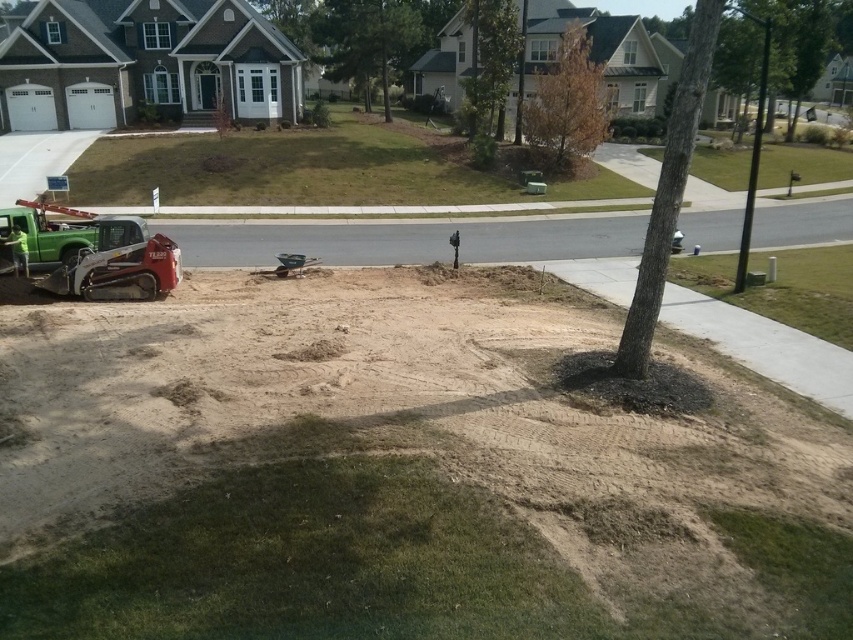
Is green leafy tree at upper center thinner than brown textured tree at center?

No, green leafy tree at upper center is not thinner than brown textured tree at center.

Is green leafy tree at upper center positioned in front of brown textured tree at center?

No.

Find the location of a particular element. The width and height of the screenshot is (853, 640). green leafy tree at upper center is located at coordinates (366, 38).

The width and height of the screenshot is (853, 640). In order to click on green leafy tree at upper center in this screenshot , I will do `click(366, 38)`.

Is brown textured tree at lower right above brown textured tree at upper center?

Incorrect, brown textured tree at lower right is not positioned above brown textured tree at upper center.

In the scene shown: Is brown textured tree at lower right bigger than brown textured tree at upper center?

Yes.

This screenshot has height=640, width=853. What do you see at coordinates (668, 192) in the screenshot?
I see `brown textured tree at lower right` at bounding box center [668, 192].

Find the location of a particular element. This screenshot has width=853, height=640. brown textured tree at lower right is located at coordinates (668, 192).

Is brown textured tree at lower right thinner than green leafy tree at upper center?

No.

Is brown textured tree at lower right to the right of green leafy tree at upper center from the viewer's perspective?

Indeed, brown textured tree at lower right is positioned on the right side of green leafy tree at upper center.

Is point (642, 371) in front of point (383, 100)?

That is True.

Where is `brown textured tree at lower right`? brown textured tree at lower right is located at coordinates (668, 192).